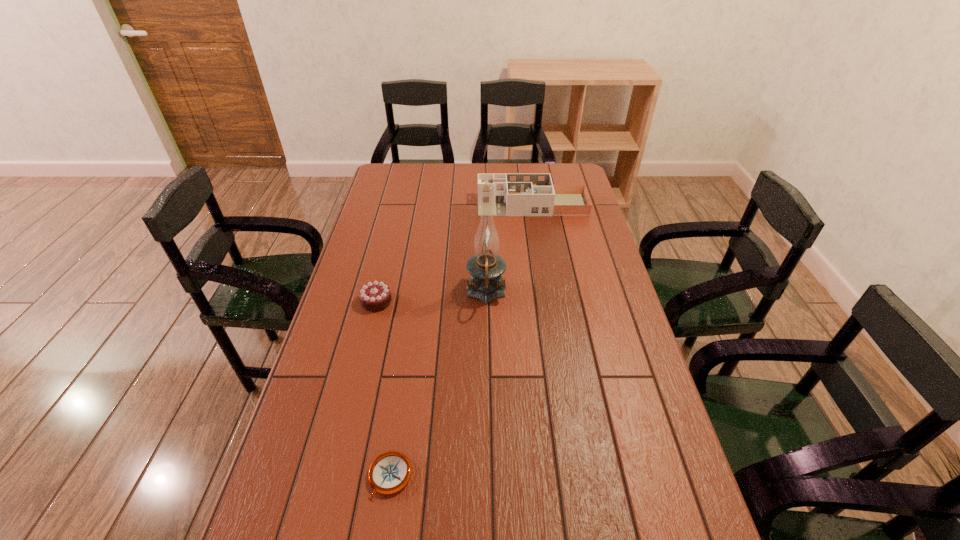
You are a GUI agent. You are given a task and a screenshot of the screen. Output one action in this format:
    pyautogui.click(x=<x>, y=<y>)
    Task: Click on the object that can be found as the closest to the leftmost object
    
    Given the screenshot: What is the action you would take?
    pyautogui.click(x=486, y=267)

This screenshot has height=540, width=960. Identify the location of object identified as the third closest to the oil lamp. (390, 472).

This screenshot has height=540, width=960. I want to click on vacant space that satisfies the following two spatial constraints: 1. at the front door of the third shortest object; 2. on the front side of the third tallest object, so click(x=547, y=301).

This screenshot has width=960, height=540. I want to click on free space that satisfies the following two spatial constraints: 1. at the front door of the second tallest object; 2. on the front side of the nearest object, so click(576, 476).

This screenshot has height=540, width=960. In order to click on vacant space that satisfies the following two spatial constraints: 1. at the front door of the third shortest object; 2. on the front side of the tallest object in this screenshot , I will do `click(546, 293)`.